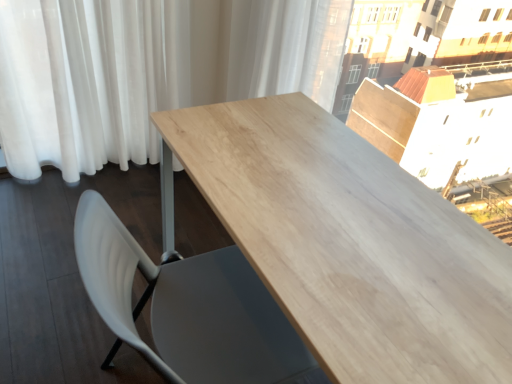
Question: From a real-world perspective, is white sheer curtain at upper center, arranged as the first curtain when viewed from the right, below white plastic chair at lower left?

Choices:
 (A) yes
 (B) no

Answer: (B)

Question: Is white sheer curtain at upper center, positioned as the 2th curtain in left-to-right order, oriented towards white plastic chair at lower left?

Choices:
 (A) no
 (B) yes

Answer: (A)

Question: Considering the relative sizes of white sheer curtain at upper center, positioned as the 2th curtain in left-to-right order, and white plastic chair at lower left in the image provided, is white sheer curtain at upper center, positioned as the 2th curtain in left-to-right order, shorter than white plastic chair at lower left?

Choices:
 (A) yes
 (B) no

Answer: (B)

Question: Is white sheer curtain at upper center, arranged as the first curtain when viewed from the right, outside of white plastic chair at lower left?

Choices:
 (A) yes
 (B) no

Answer: (A)

Question: Considering the relative positions of white sheer curtain at upper center, arranged as the first curtain when viewed from the right, and white plastic chair at lower left in the image provided, is white sheer curtain at upper center, arranged as the first curtain when viewed from the right, behind white plastic chair at lower left?

Choices:
 (A) no
 (B) yes

Answer: (B)

Question: Does white sheer curtain at upper center, arranged as the first curtain when viewed from the right, have a smaller size compared to white plastic chair at lower left?

Choices:
 (A) no
 (B) yes

Answer: (A)

Question: From the image's perspective, is white plastic chair at lower left located above white sheer curtain at upper center, positioned as the 2th curtain in left-to-right order?

Choices:
 (A) no
 (B) yes

Answer: (A)

Question: Considering the relative sizes of white plastic chair at lower left and white sheer curtain at upper center, arranged as the first curtain when viewed from the right, in the image provided, is white plastic chair at lower left wider than white sheer curtain at upper center, arranged as the first curtain when viewed from the right,?

Choices:
 (A) yes
 (B) no

Answer: (A)

Question: Is there a large distance between white plastic chair at lower left and white sheer curtain at upper center, positioned as the 2th curtain in left-to-right order?

Choices:
 (A) no
 (B) yes

Answer: (A)

Question: Is white plastic chair at lower left with white sheer curtain at upper center, positioned as the 2th curtain in left-to-right order?

Choices:
 (A) yes
 (B) no

Answer: (B)

Question: Considering the relative sizes of white plastic chair at lower left and white sheer curtain at upper center, positioned as the 2th curtain in left-to-right order, in the image provided, is white plastic chair at lower left taller than white sheer curtain at upper center, positioned as the 2th curtain in left-to-right order,?

Choices:
 (A) yes
 (B) no

Answer: (B)

Question: Would you say white plastic chair at lower left is outside white sheer curtain at upper center, positioned as the 2th curtain in left-to-right order?

Choices:
 (A) no
 (B) yes

Answer: (B)

Question: From the image's perspective, would you say white sheer curtain at upper center, positioned as the 2th curtain in left-to-right order, is shown under light wood table at center?

Choices:
 (A) yes
 (B) no

Answer: (B)